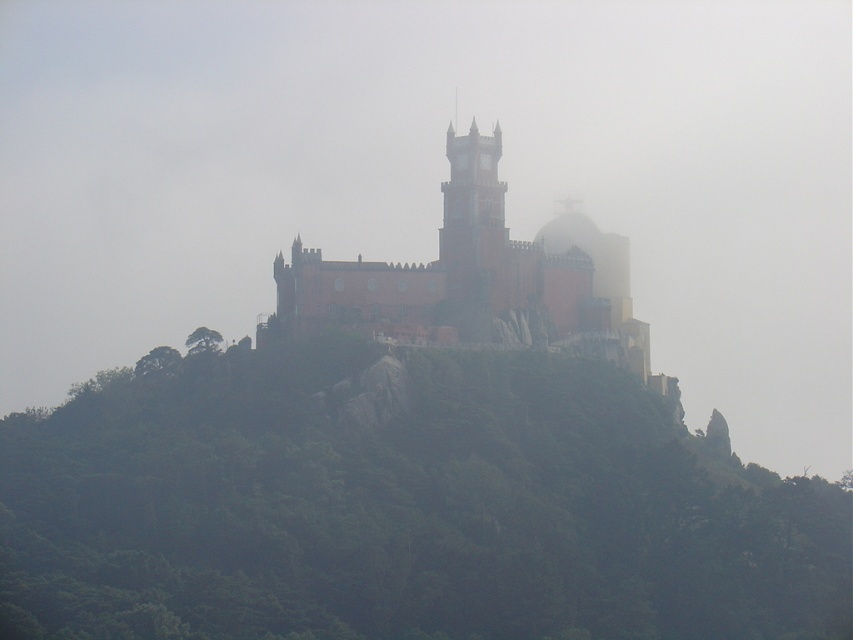
Does green leafy hillside at center have a larger size compared to matte pink stone tower at center?

Yes.

What do you see at coordinates (401, 508) in the screenshot? I see `green leafy hillside at center` at bounding box center [401, 508].

Which is in front, point (195, 364) or point (450, 196)?

Positioned in front is point (195, 364).

Where is `green leafy hillside at center`? This screenshot has width=853, height=640. green leafy hillside at center is located at coordinates (401, 508).

Is green leafy hillside at center smaller than matte pink stone castle at center?

No.

Is point (28, 557) farther from camera compared to point (451, 152)?

That is False.

The height and width of the screenshot is (640, 853). I want to click on green leafy hillside at center, so click(401, 508).

Identify the location of green leafy hillside at center. This screenshot has width=853, height=640. (401, 508).

From the picture: Measure the distance between matte pink stone castle at center and matte pink stone tower at center.

matte pink stone castle at center is 11.48 feet from matte pink stone tower at center.

Is point (625, 285) farther from viewer compared to point (490, 296)?

Yes, point (625, 285) is farther from viewer.

Identify the location of matte pink stone castle at center. The width and height of the screenshot is (853, 640). (479, 278).